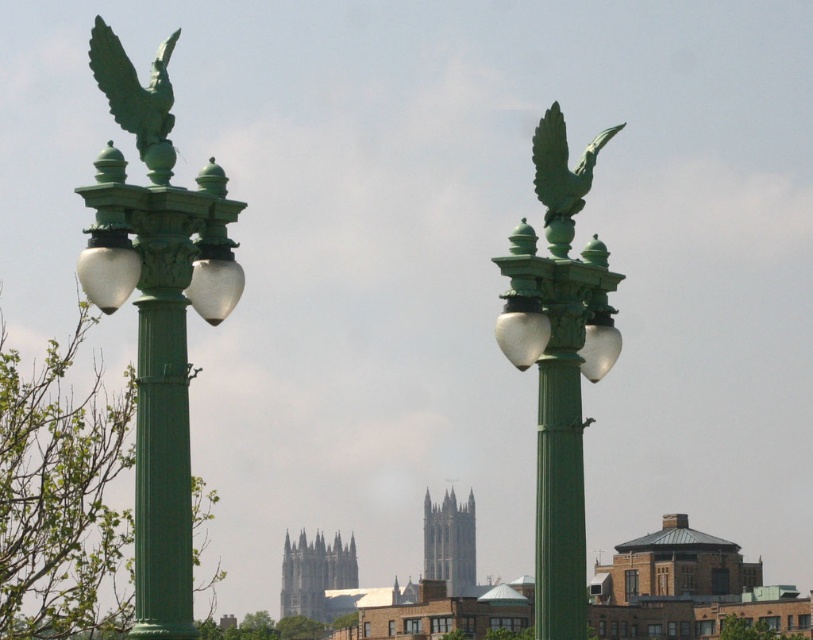
You are standing in front of the two ornate green lampposts in the image. You notice two points marked on the lampposts. The first point is at coordinates point (127, 124) and the second is at point (148, 100). Which of these points is nearer to your viewpoint?

Point (127, 124) is closer to the camera than point (148, 100).

You are an architect designing a city model and need to place the green matte eagle at upper right and the gray stone tower at center. Based on the image, which object should be placed higher in your model?

The green matte eagle at upper right should be placed higher in the model because it is positioned over the gray stone tower at center in the image.